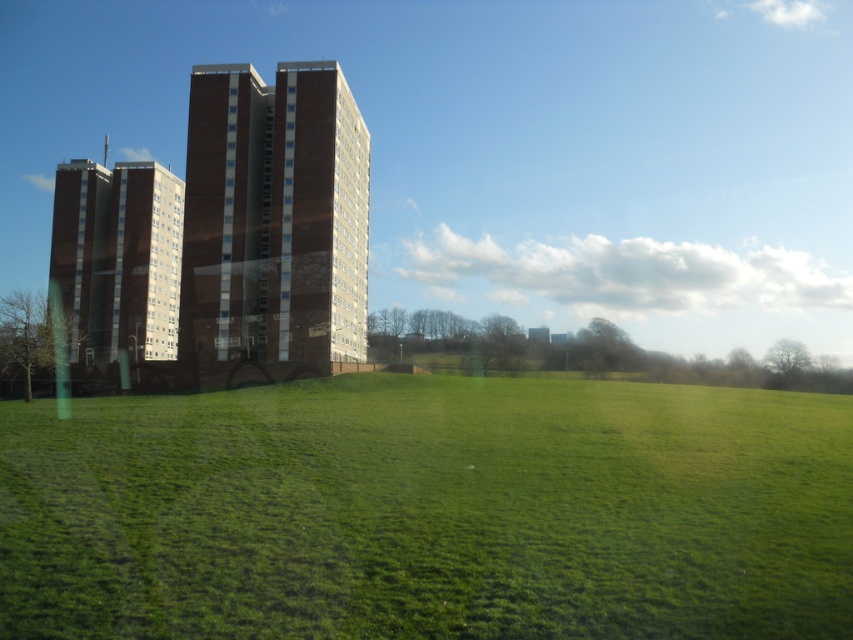
Question: Estimate the real-world distances between objects in this image. Which object is farther from the brown brick building at center?

Choices:
 (A) brown brick building at left
 (B) green grass at center

Answer: (B)

Question: Which point is farther to the camera?

Choices:
 (A) brown brick building at center
 (B) green grass at center
 (C) brown brick building at left

Answer: (A)

Question: Considering the relative positions of green grass at center and brown brick building at left in the image provided, where is green grass at center located with respect to brown brick building at left?

Choices:
 (A) below
 (B) above

Answer: (A)

Question: Does brown brick building at center have a lesser width compared to brown brick building at left?

Choices:
 (A) yes
 (B) no

Answer: (A)

Question: Which object is positioned closest to the brown brick building at center?

Choices:
 (A) green grass at center
 (B) brown brick building at left

Answer: (B)

Question: Is brown brick building at center thinner than brown brick building at left?

Choices:
 (A) no
 (B) yes

Answer: (B)